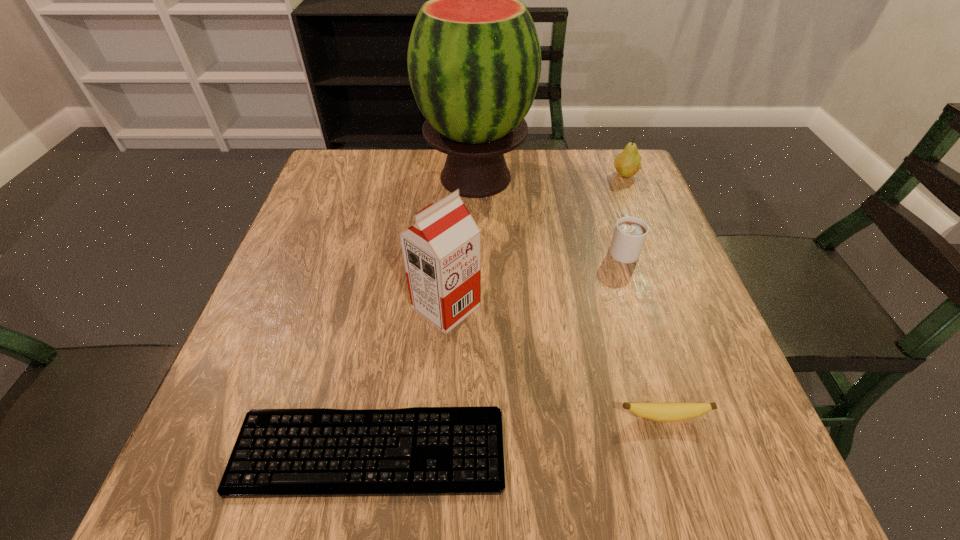
Identify the location of vacant space located on the left of the pear. The height and width of the screenshot is (540, 960). (575, 175).

At what (x,y) coordinates should I click in order to perform the action: click on vacant space located on the side with the handle of the third shortest object. Please return your answer as a coordinate pair (x, y). Looking at the image, I should click on (591, 156).

Locate an element on the screen. This screenshot has height=540, width=960. free spot located 0.180m on the side with the handle of the third shortest object is located at coordinates (603, 190).

In order to click on vacant space located 0.380m on the side with the handle of the third shortest object in this screenshot , I will do `click(589, 150)`.

Identify the location of vacant space located on the front of the fifth tallest object. This screenshot has width=960, height=540. (688, 497).

Identify the location of free space located on the back of the computer keyboard. (384, 368).

Locate an element on the screen. The height and width of the screenshot is (540, 960). watermelon present at the far edge is located at coordinates point(474,59).

Identify the location of pear located at the far edge. The width and height of the screenshot is (960, 540). (628, 163).

You are a GUI agent. You are given a task and a screenshot of the screen. Output one action in this format:
    pyautogui.click(x=<x>, y=<y>)
    Task: Click on the object at the near edge
    
    Given the screenshot: What is the action you would take?
    pyautogui.click(x=422, y=451)

Locate an element on the screen. object present at the left edge is located at coordinates (422, 451).